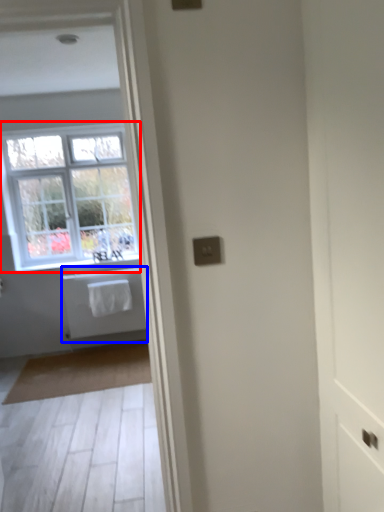
Question: Which object is further to the camera taking this photo, window (highlighted by a red box) or bath (highlighted by a blue box)?

Choices:
 (A) window
 (B) bath

Answer: (B)